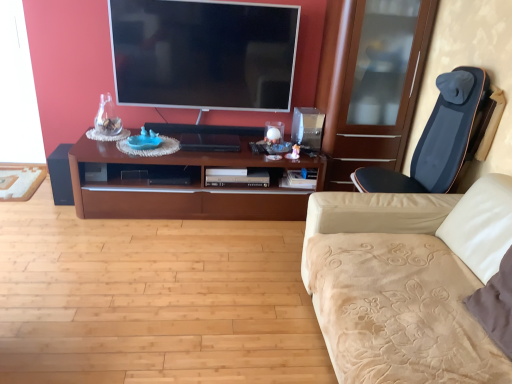
Identify the location of free location in front of black matte speaker at left. (45, 212).